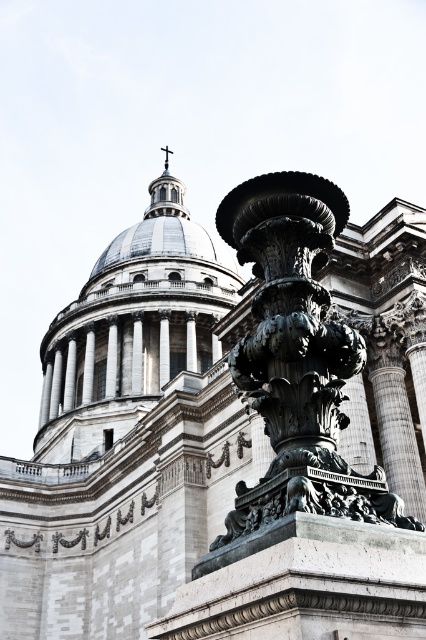
You are standing in front of the grand architectural structure with its majestic dome. You notice the polished bronze fountain at center. Based on its coordinates, is the fountain closer to the front or the back of the structure?

The polished bronze fountain at center is located at point (296, 358), which places it closer to the back of the structure since the coordinates are closer to the upper right quadrant, indicating a position further away from the observer.

You are standing in front of the grand building and want to take a photo of both the polished bronze fountain at center and the white marble dome at upper center. Which object should you position to the left side of your camera frame to include both in the shot?

You should position the white marble dome at upper center to the left side of your camera frame because the polished bronze fountain at center is to the right of it, ensuring both are captured in the shot.

You are an architect examining the building from the front. You notice the white marble dome at upper center and the metallic cross at upper center. Which object is positioned higher in the image?

The metallic cross at upper center is positioned higher than the white marble dome at upper center because the dome is located below the cross.